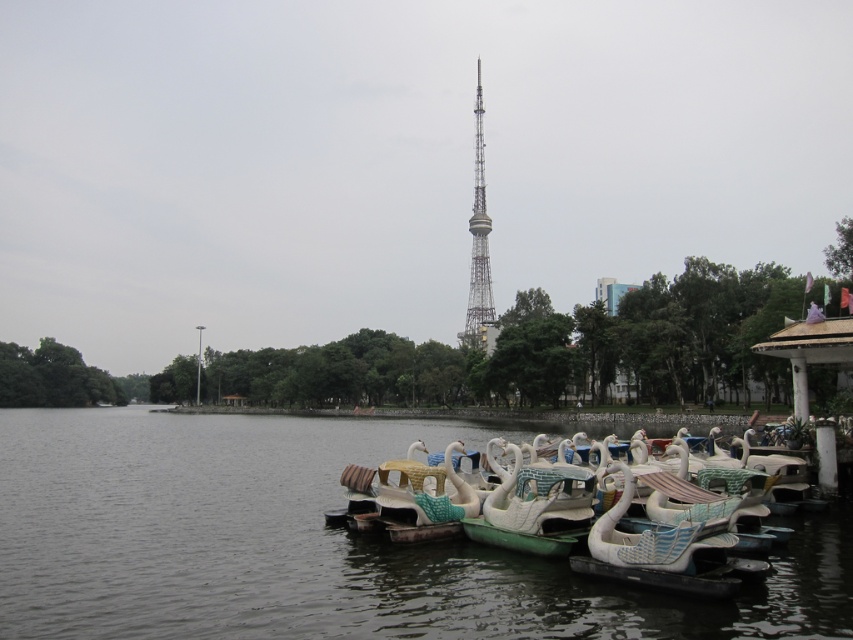
You are standing at the lakeside and want to compare the heights of the transparent plastic water at lower right and the metallic lattice tower at center. Which one is taller?

The metallic lattice tower at center is taller than the transparent plastic water at lower right.